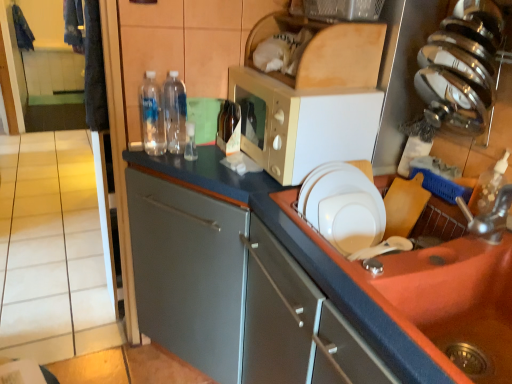
Identify the location of transparent plastic bottle at center, the 2th bottle viewed from the right. (175, 112).

Describe the element at coordinates (461, 68) in the screenshot. The width and height of the screenshot is (512, 384). I see `satin silver knife block at upper right` at that location.

This screenshot has height=384, width=512. Describe the element at coordinates (385, 281) in the screenshot. I see `matte gray cabinet at center` at that location.

Find the location of a particular element. This screenshot has height=384, width=512. orange matte sink at lower right is located at coordinates (457, 298).

You are a GUI agent. You are given a task and a screenshot of the screen. Output one action in this format:
    pyautogui.click(x=<x>, y=<y>)
    Task: Click on the metallic silver faucet at sink right
    
    Given the screenshot: What is the action you would take?
    pyautogui.click(x=489, y=216)

Based on the photo, is metallic silver faucet at sink right surrounding satin silver knife block at upper right?

No, satin silver knife block at upper right is not a part of metallic silver faucet at sink right.

Are metallic silver faucet at sink right and satin silver knife block at upper right located far from each other?

No, metallic silver faucet at sink right is not far away from satin silver knife block at upper right.

Which of these two, metallic silver faucet at sink right or satin silver knife block at upper right, stands taller?

satin silver knife block at upper right.

From a real-world perspective, which is physically below, metallic silver faucet at sink right or satin silver knife block at upper right?

In real-world perspective, metallic silver faucet at sink right is lower.

Which of these two, transparent plastic bottle at center, the 2th bottle viewed from the right, or matte gray cabinet at center, is wider?

Wider between the two is matte gray cabinet at center.

Can you tell me how much transparent plastic bottle at center, the 2th bottle when ordered from left to right, and matte gray cabinet at center differ in facing direction?

90 degrees separate the facing orientations of transparent plastic bottle at center, the 2th bottle when ordered from left to right, and matte gray cabinet at center.

Is transparent plastic bottle at center, the 2th bottle when ordered from left to right, far from matte gray cabinet at center?

No, transparent plastic bottle at center, the 2th bottle when ordered from left to right, is not far away from matte gray cabinet at center.

From the image's perspective, which is above, transparent plastic bottle at center, the 2th bottle when ordered from left to right, or matte gray cabinet at center?

A: transparent plastic bottle at center, the 2th bottle when ordered from left to right.

From the white matte microwave at upper center, count the 2nd bottle to the left and point to it. Please provide its 2D coordinates.

[(175, 112)]

Is transparent plastic bottle at center, the 2th bottle when ordered from left to right, at the back of white matte microwave at upper center?

No.

Can we say white matte microwave at upper center lies outside transparent plastic bottle at center, the 2th bottle viewed from the right?

Yes, white matte microwave at upper center is outside of transparent plastic bottle at center, the 2th bottle viewed from the right.

Considering the sizes of objects white matte microwave at upper center and transparent plastic bottle at center, the 2th bottle when ordered from left to right, in the image provided, who is wider, white matte microwave at upper center or transparent plastic bottle at center, the 2th bottle when ordered from left to right,?

white matte microwave at upper center.

Can you confirm if metallic silver faucet at sink right is positioned to the right of transparent plastic bottle at center, the 2th bottle viewed from the right?

Correct, you'll find metallic silver faucet at sink right to the right of transparent plastic bottle at center, the 2th bottle viewed from the right.

Is metallic silver faucet at sink right shorter than transparent plastic bottle at center, the 2th bottle viewed from the right?

Correct, metallic silver faucet at sink right is not as tall as transparent plastic bottle at center, the 2th bottle viewed from the right.

Is metallic silver faucet at sink right located outside transparent plastic bottle at center, the 2th bottle viewed from the right?

Indeed, metallic silver faucet at sink right is completely outside transparent plastic bottle at center, the 2th bottle viewed from the right.

Would you say white matte microwave at upper center is to the left or to the right of clear plastic bottle at center, the third bottle from the right, in the picture?

white matte microwave at upper center is to the right of clear plastic bottle at center, the third bottle from the right.

Is white matte microwave at upper center thinner than clear plastic bottle at center, marked as the 1th bottle in a left-to-right arrangement?

In fact, white matte microwave at upper center might be wider than clear plastic bottle at center, marked as the 1th bottle in a left-to-right arrangement.

How many degrees apart are the facing directions of white matte microwave at upper center and clear plastic bottle at center, the third bottle from the right?

The angular difference between white matte microwave at upper center and clear plastic bottle at center, the third bottle from the right, is 89.5 degrees.

Does point (303, 156) lie in front of point (144, 98)?

That is True.

Does metallic silver faucet at sink right have a smaller size compared to white glossy plate at upper right?

Yes.

Can you tell me how much metallic silver faucet at sink right and white glossy plate at upper right differ in facing direction?

metallic silver faucet at sink right and white glossy plate at upper right are facing 83.7 degrees away from each other.

From a real-world perspective, does metallic silver faucet at sink right stand above white glossy plate at upper right?

Yes, from a real-world perspective, metallic silver faucet at sink right is on top of white glossy plate at upper right.

Considering the points (505, 224) and (320, 217), which point is in front, point (505, 224) or point (320, 217)?

The point (505, 224) is in front.

Is metallic silver faucet at sink right taller than brown glass bottle at center, which is the 1th bottle in right-to-left order?

In fact, metallic silver faucet at sink right may be shorter than brown glass bottle at center, which is the 1th bottle in right-to-left order.

Based on the photo, based on their sizes in the image, would you say metallic silver faucet at sink right is bigger or smaller than brown glass bottle at center, which appears as the third bottle when viewed from the left?

Clearly, metallic silver faucet at sink right is larger in size than brown glass bottle at center, which appears as the third bottle when viewed from the left.

Consider the image. Is metallic silver faucet at sink right positioned before brown glass bottle at center, which is the 1th bottle in right-to-left order?

Yes.

Which point is more distant from viewer, (495, 240) or (234, 123)?

Positioned behind is point (234, 123).

Find the location of `appliance lying on the left of metallic silver faucet at sink right`. appliance lying on the left of metallic silver faucet at sink right is located at coordinates (461, 68).

Locate an element on the screen. The width and height of the screenshot is (512, 384). the 2nd bottle located above the matte gray cabinet at center (from a real-world perspective) is located at coordinates (175, 112).

When comparing their distances from metallic silver faucet at sink right, does orange matte sink at lower right or white glossy plate at upper right seem further?

Among the two, white glossy plate at upper right is located further to metallic silver faucet at sink right.

Estimate the real-world distances between objects in this image. Which object is further from brown glass bottle at center, which appears as the third bottle when viewed from the left, metallic silver faucet at sink right or beige tile at left?

beige tile at left.

When comparing their distances from orange matte sink at lower right, does metallic silver faucet at sink right or clear plastic bottle at center, marked as the 1th bottle in a left-to-right arrangement, seem closer?

metallic silver faucet at sink right is closer to orange matte sink at lower right.

Which object lies nearer to the anchor point orange matte sink at lower right, brown glass bottle at center, which is the 1th bottle in right-to-left order, or clear plastic bottle at center, the third bottle from the right?

Among the two, brown glass bottle at center, which is the 1th bottle in right-to-left order, is located nearer to orange matte sink at lower right.

Considering their positions, is matte gray cabinet at center positioned closer to transparent plastic bottle at center, the 2th bottle when ordered from left to right, than orange matte sink at lower right?

The object closer to transparent plastic bottle at center, the 2th bottle when ordered from left to right, is matte gray cabinet at center.

Considering their positions, is beige tile at left positioned further to transparent plastic bottle at center, the 2th bottle viewed from the right, than orange matte sink at lower right?

Based on the image, beige tile at left appears to be further to transparent plastic bottle at center, the 2th bottle viewed from the right.

When comparing their distances from clear plastic bottle at center, marked as the 1th bottle in a left-to-right arrangement, does brown glass bottle at center, which is the 1th bottle in right-to-left order, or beige tile at left seem further?

beige tile at left is positioned further to the anchor clear plastic bottle at center, marked as the 1th bottle in a left-to-right arrangement.

Looking at this image, looking at the image, which one is located closer to beige tile at left, transparent plastic bottle at center, the 2th bottle when ordered from left to right, or satin silver knife block at upper right?

transparent plastic bottle at center, the 2th bottle when ordered from left to right, is closer to beige tile at left.

Where is `cabinetry between transparent plastic bottle at center, the 2th bottle when ordered from left to right, and satin silver knife block at upper right, in the horizontal direction`? cabinetry between transparent plastic bottle at center, the 2th bottle when ordered from left to right, and satin silver knife block at upper right, in the horizontal direction is located at coordinates (385, 281).

I want to click on cabinetry situated between clear plastic bottle at center, the third bottle from the right, and white glossy plate at upper right from left to right, so click(385, 281).

This screenshot has height=384, width=512. I want to click on faucet between orange matte sink at lower right and white glossy plate at upper right in the front-back direction, so click(489, 216).

Where is `microwave oven between clear plastic bottle at center, marked as the 1th bottle in a left-to-right arrangement, and matte gray cabinet at center vertically`? This screenshot has width=512, height=384. microwave oven between clear plastic bottle at center, marked as the 1th bottle in a left-to-right arrangement, and matte gray cabinet at center vertically is located at coordinates (304, 124).